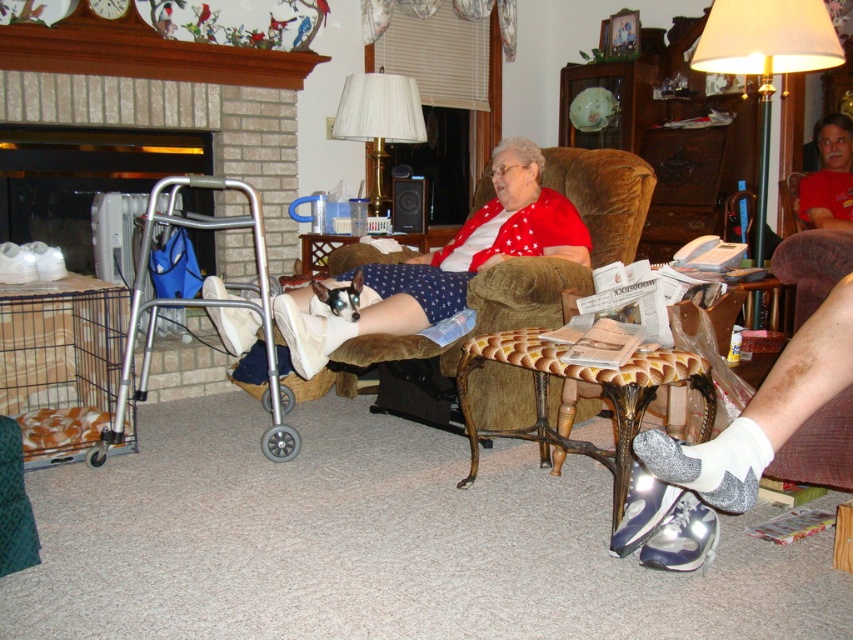
Who is positioned more to the left, velvet brown armchair at center or white fabric lampshade at upper center?

white fabric lampshade at upper center is more to the left.

Can you confirm if velvet brown armchair at center is thinner than white fabric lampshade at upper center?

In fact, velvet brown armchair at center might be wider than white fabric lampshade at upper center.

Does point (374, 353) come in front of point (381, 109)?

Yes, point (374, 353) is closer to viewer.

This screenshot has width=853, height=640. I want to click on velvet brown armchair at center, so click(x=482, y=312).

In the scene shown: Who is shorter, white textured socks at lower right or printed paper magazine at center?

white textured socks at lower right

Is point (691, 468) farther from camera compared to point (636, 305)?

No, (691, 468) is closer to viewer.

This screenshot has width=853, height=640. I want to click on white textured socks at lower right, so click(711, 464).

Who is higher up, silver metallic walker at left or gold metallic floor lamp at upper right?

gold metallic floor lamp at upper right is higher up.

Is point (265, 262) behind point (730, 35)?

No, (265, 262) is closer to viewer.

Describe the element at coordinates (204, 307) in the screenshot. This screenshot has width=853, height=640. I see `silver metallic walker at left` at that location.

Find the location of `silver metallic walker at left`. silver metallic walker at left is located at coordinates (204, 307).